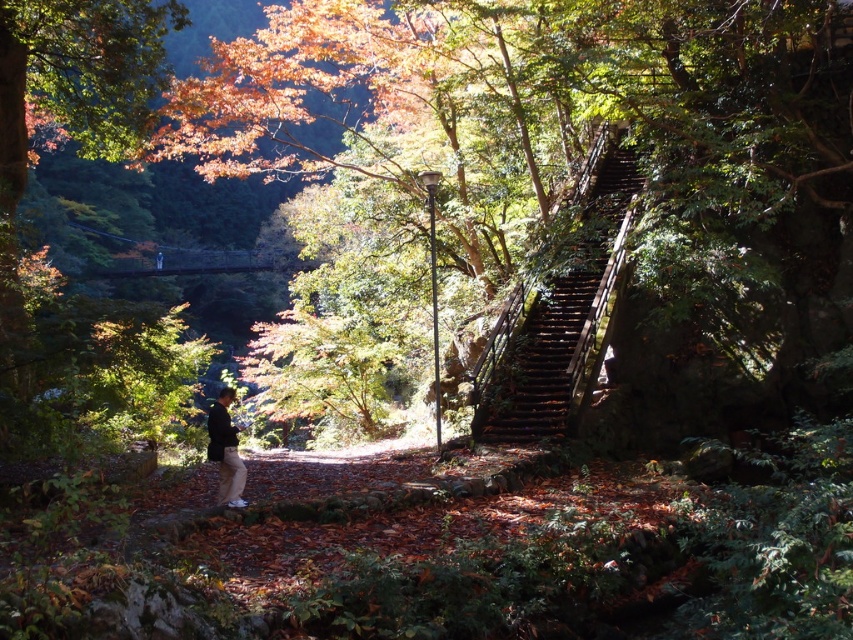
You are a hiker trying to reach the top of the stairs in the forest. The map shows that the rusty wood stairs at right are located at coordinates 0.494, 0.662. If you are currently at the base of the stairs, which direction should you move to reach the top?

Since the rusty wood stairs at right are positioned at coordinates (564, 316), you should move upward along the stairs to reach the top.

You are a hiker who wants to take a photo of the wooden stairs at right. You have a camera with a zoom lens. The point you are focusing on is at coordinate point [564,316]. Is this point on the wooden stairs at right?

Yes, the point [564,316] is on the wooden stairs at right, so you can take the photo focusing on that point.